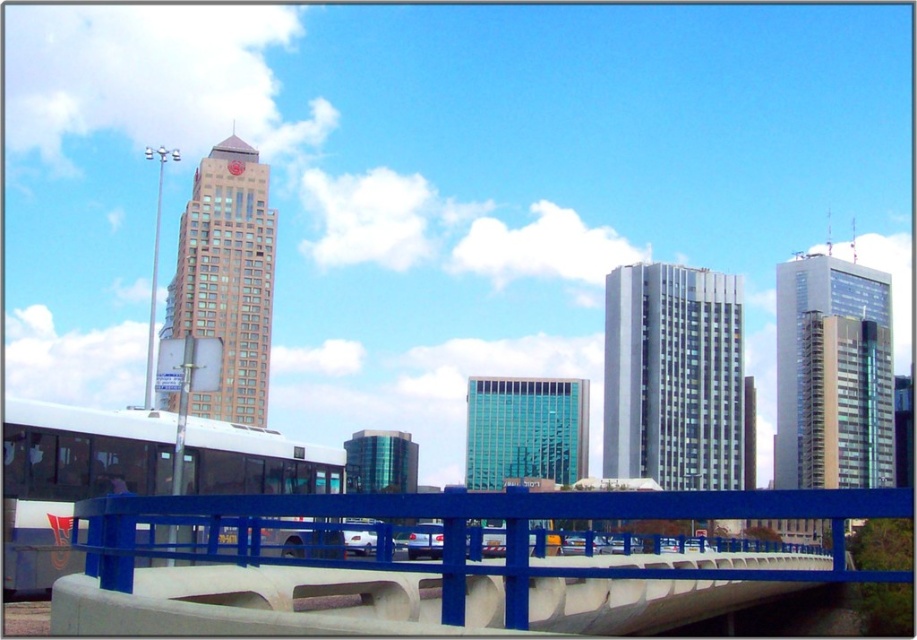
Is silver glass skyscraper at center above beige glass tower at upper left?

No, silver glass skyscraper at center is not above beige glass tower at upper left.

From the picture: Can you confirm if silver glass skyscraper at center is positioned to the left of beige glass tower at upper left?

Incorrect, silver glass skyscraper at center is not on the left side of beige glass tower at upper left.

This screenshot has height=640, width=917. Describe the element at coordinates (676, 378) in the screenshot. I see `silver glass skyscraper at center` at that location.

You are a GUI agent. You are given a task and a screenshot of the screen. Output one action in this format:
    pyautogui.click(x=<x>, y=<y>)
    Task: Click on the silver glass skyscraper at center
    This screenshot has height=640, width=917.
    Given the screenshot: What is the action you would take?
    pyautogui.click(x=676, y=378)

Is silver glass skyscraper at right to the right of beige glass tower at upper left from the viewer's perspective?

Indeed, silver glass skyscraper at right is positioned on the right side of beige glass tower at upper left.

Who is more forward, (862, 372) or (246, 353)?

Point (246, 353)

Between point (887, 433) and point (172, 285), which one is positioned behind?

The point (887, 433) is more distant.

Where is `silver glass skyscraper at right`? silver glass skyscraper at right is located at coordinates (833, 374).

Is silver glass skyscraper at center thinner than silver glass skyscraper at right?

Yes, silver glass skyscraper at center is thinner than silver glass skyscraper at right.

Which is below, silver glass skyscraper at center or silver glass skyscraper at right?

silver glass skyscraper at center is below.

The image size is (917, 640). Identify the location of silver glass skyscraper at center. (676, 378).